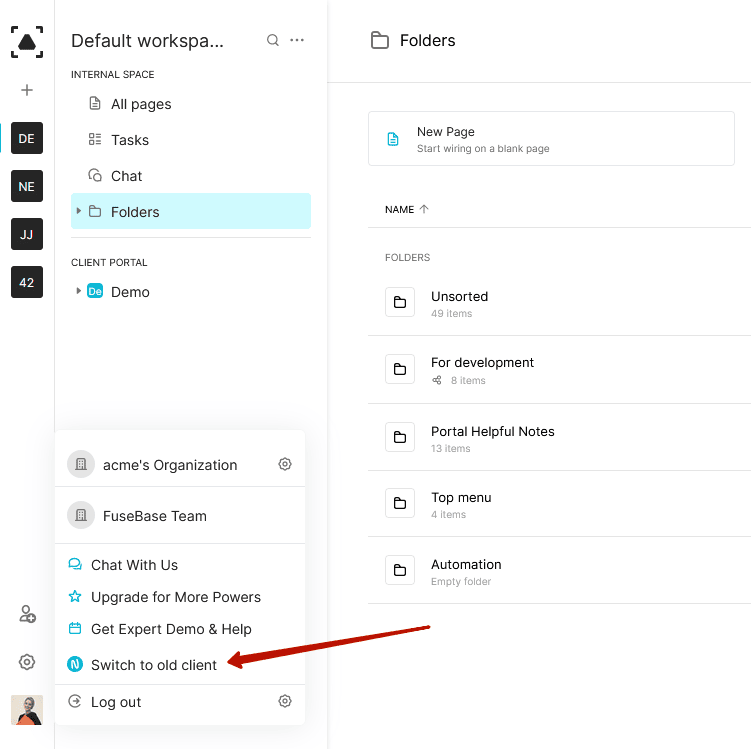
This screenshot has height=749, width=751. Identify the location of folders. (418, 39).